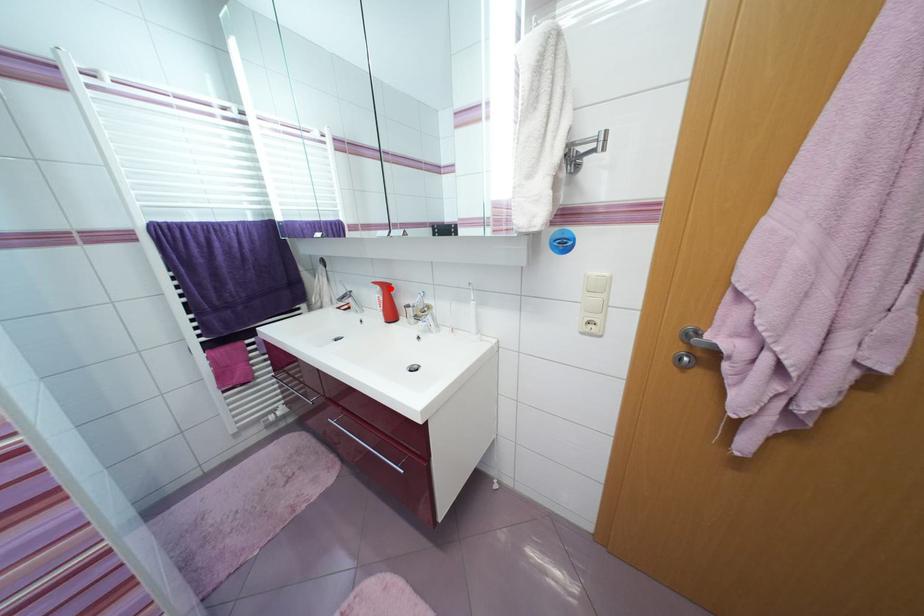
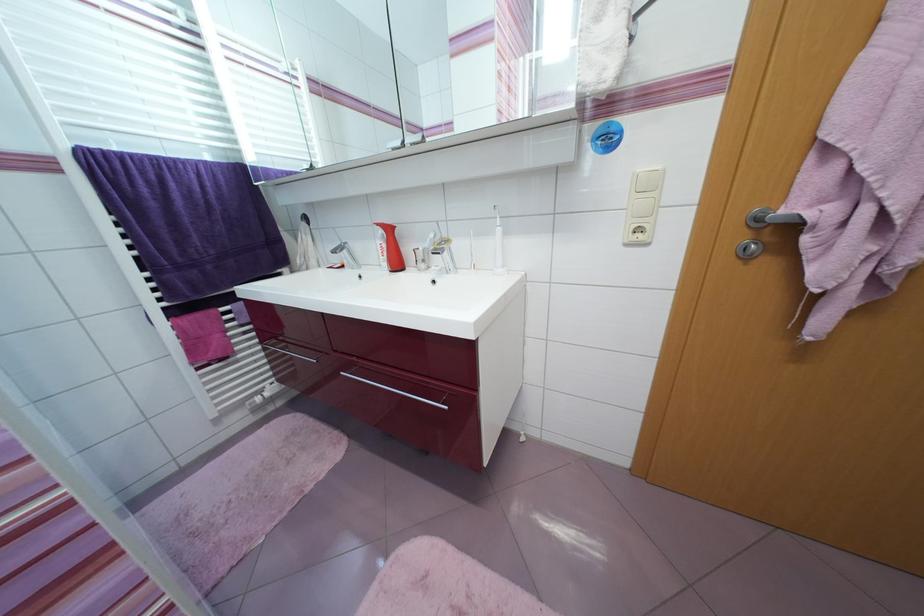
Where in the second image is the point corresponding to the highlighted location from the first image?

(394, 231)